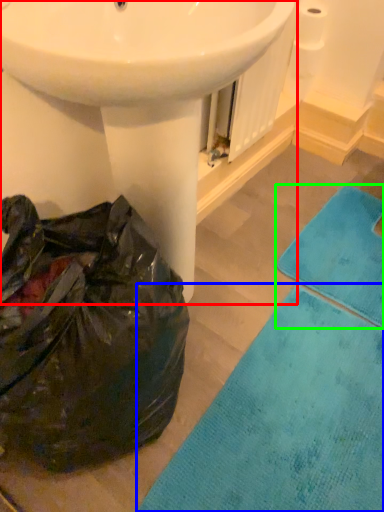
Question: Which object is positioned closest to sink (highlighted by a red box)? Select from bath mat (highlighted by a blue box) and bath towel (highlighted by a green box).

Choices:
 (A) bath mat
 (B) bath towel

Answer: (A)